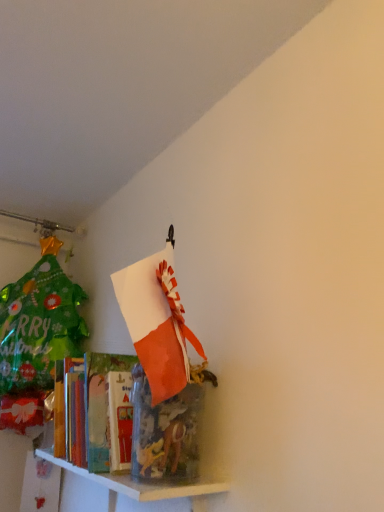
Question: Does white glossy shelf at lower left, arranged as the 2th shelf when viewed from the top, turn towards translucent plastic container at lower left, which is the 2th shelf in bottom-to-top order?

Choices:
 (A) yes
 (B) no

Answer: (B)

Question: Is white glossy shelf at lower left, arranged as the 2th shelf when viewed from the top, next to translucent plastic container at lower left, arranged as the first shelf when viewed from the top, and touching it?

Choices:
 (A) yes
 (B) no

Answer: (A)

Question: Does white glossy shelf at lower left, arranged as the 2th shelf when viewed from the top, have a lesser width compared to translucent plastic container at lower left, which is the 2th shelf in bottom-to-top order?

Choices:
 (A) yes
 (B) no

Answer: (A)

Question: Is white glossy shelf at lower left, arranged as the 2th shelf when viewed from the top, positioned behind translucent plastic container at lower left, arranged as the first shelf when viewed from the top?

Choices:
 (A) yes
 (B) no

Answer: (B)

Question: Is white glossy shelf at lower left, arranged as the 1th shelf when ordered from the bottom, looking in the opposite direction of translucent plastic container at lower left, which is the 2th shelf in bottom-to-top order?

Choices:
 (A) yes
 (B) no

Answer: (B)

Question: From a real-world perspective, does white glossy shelf at lower left, arranged as the 1th shelf when ordered from the bottom, stand above translucent plastic container at lower left, which is the 2th shelf in bottom-to-top order?

Choices:
 (A) no
 (B) yes

Answer: (A)

Question: Considering the relative sizes of translucent plastic container at lower left, arranged as the first shelf when viewed from the top, and white glossy shelf at lower left, arranged as the 2th shelf when viewed from the top, in the image provided, is translucent plastic container at lower left, arranged as the first shelf when viewed from the top, shorter than white glossy shelf at lower left, arranged as the 2th shelf when viewed from the top,?

Choices:
 (A) yes
 (B) no

Answer: (B)

Question: Could white glossy shelf at lower left, arranged as the 2th shelf when viewed from the top, be considered to be inside translucent plastic container at lower left, which is the 2th shelf in bottom-to-top order?

Choices:
 (A) yes
 (B) no

Answer: (B)

Question: Is translucent plastic container at lower left, which is the 2th shelf in bottom-to-top order, not near white glossy shelf at lower left, arranged as the 2th shelf when viewed from the top?

Choices:
 (A) yes
 (B) no

Answer: (B)

Question: Is translucent plastic container at lower left, arranged as the first shelf when viewed from the top, outside of white glossy shelf at lower left, arranged as the 1th shelf when ordered from the bottom?

Choices:
 (A) no
 (B) yes

Answer: (B)

Question: Is translucent plastic container at lower left, arranged as the first shelf when viewed from the top, to the right of white glossy shelf at lower left, arranged as the 1th shelf when ordered from the bottom, from the viewer's perspective?

Choices:
 (A) no
 (B) yes

Answer: (A)

Question: From a real-world perspective, does translucent plastic container at lower left, arranged as the first shelf when viewed from the top, stand above white glossy shelf at lower left, arranged as the 1th shelf when ordered from the bottom?

Choices:
 (A) no
 (B) yes

Answer: (B)

Question: Choose the correct answer: Is translucent plastic container at lower left, arranged as the first shelf when viewed from the top, inside white glossy shelf at lower left, arranged as the 1th shelf when ordered from the bottom, or outside it?

Choices:
 (A) inside
 (B) outside

Answer: (B)